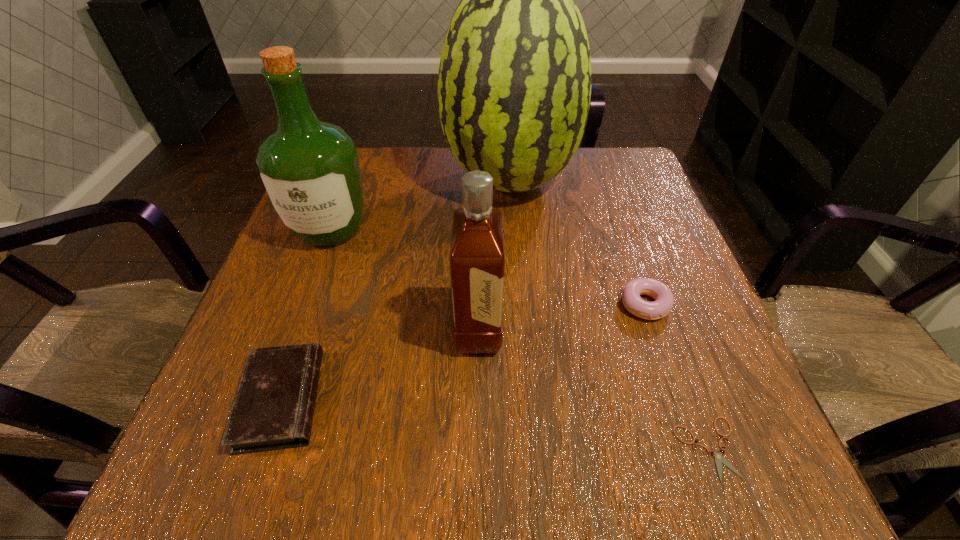
The height and width of the screenshot is (540, 960). Find the location of `free space in the image that satisfies the following two spatial constraints: 1. on the front-facing side of the diary; 2. on the right side of the taller liquor`. free space in the image that satisfies the following two spatial constraints: 1. on the front-facing side of the diary; 2. on the right side of the taller liquor is located at coordinates (268, 400).

You are a GUI agent. You are given a task and a screenshot of the screen. Output one action in this format:
    pyautogui.click(x=<x>, y=<y>)
    Task: Click on the blank area in the image that satisfies the following two spatial constraints: 1. on the front-facing side of the diary; 2. on the left side of the second tallest object
    The image size is (960, 540).
    Given the screenshot: What is the action you would take?
    [x=268, y=400]